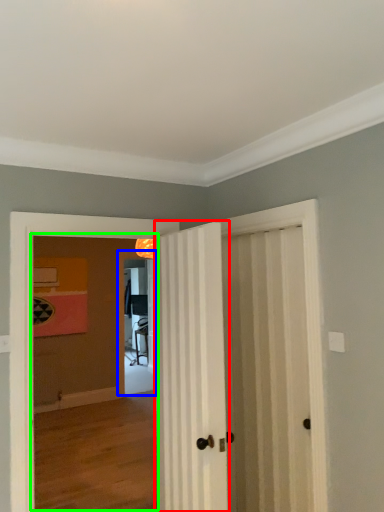
Question: Which is farther away from door (highlighted by a red box)? screen door (highlighted by a blue box) or corridor (highlighted by a green box)?

Choices:
 (A) screen door
 (B) corridor

Answer: (A)